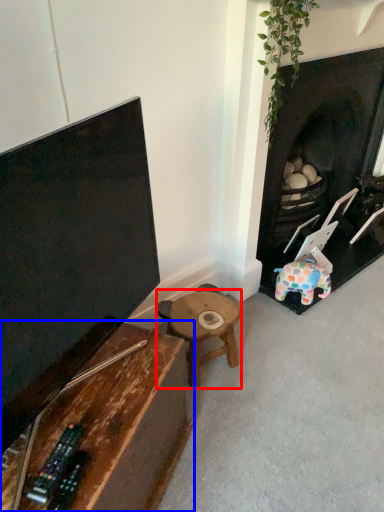
Question: Which point is closer to the camera, table (highlighted by a red box) or table (highlighted by a blue box)?

Choices:
 (A) table
 (B) table

Answer: (B)